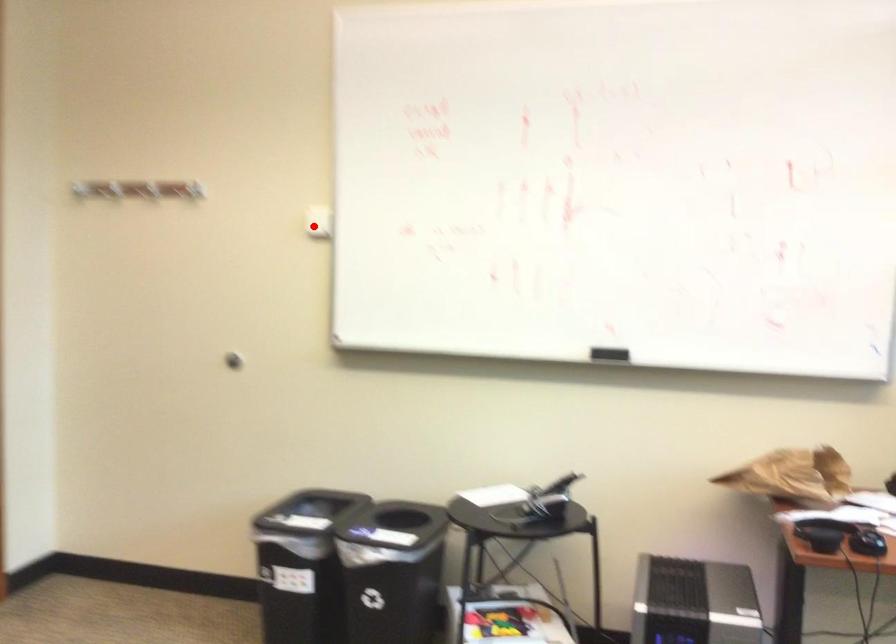
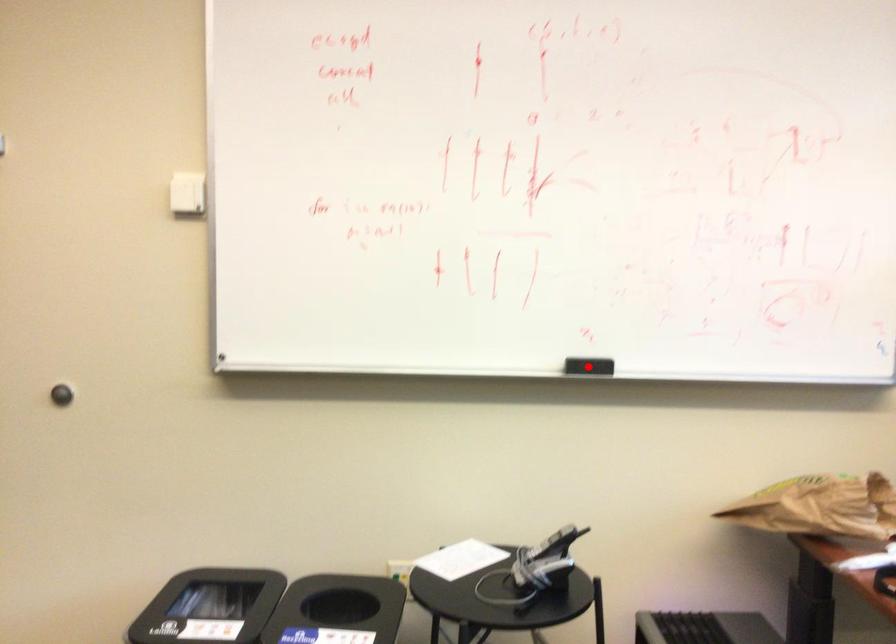
I am providing you with two images of the same scene from different viewpoints. A red point is marked on the first image and another point is marked on the second image. Do the highlighted points in image1 and image2 indicate the same real-world spot?

No